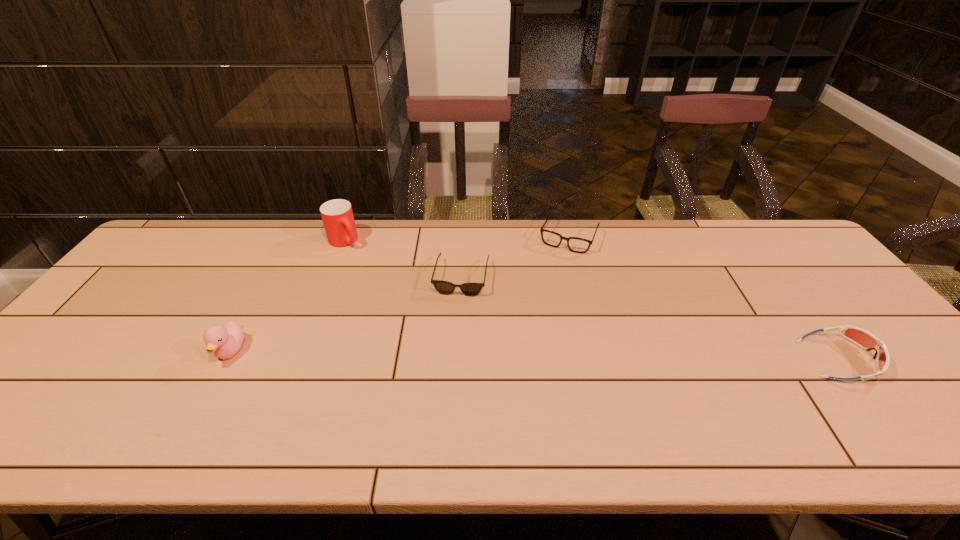
Where is `sunglasses that is at the far edge`? This screenshot has height=540, width=960. sunglasses that is at the far edge is located at coordinates (444, 287).

Image resolution: width=960 pixels, height=540 pixels. Find the location of `cup at the far edge`. cup at the far edge is located at coordinates (337, 215).

Locate an element on the screen. Image resolution: width=960 pixels, height=540 pixels. object that is positioned at the near edge is located at coordinates (863, 338).

Find the location of a particular element. This screenshot has height=540, width=960. object that is positioned at the right edge is located at coordinates (863, 338).

You are a GUI agent. You are given a task and a screenshot of the screen. Output one action in this format:
    pyautogui.click(x=<x>, y=<y>)
    Task: Click on the object present at the near right corner
    This screenshot has height=540, width=960.
    Given the screenshot: What is the action you would take?
    [863, 338]

The width and height of the screenshot is (960, 540). In the image, there is a desktop. Find the location of `free space at the far edge`. free space at the far edge is located at coordinates (326, 249).

Identify the location of vacant space at the near edge of the desktop. (100, 405).

The image size is (960, 540). What are the coordinates of `vacant region at the left edge of the desktop` in the screenshot? It's located at (184, 272).

At what (x,y) coordinates should I click in order to perform the action: click on free region at the right edge of the desktop. Please return your answer as a coordinate pair (x, y). Looking at the image, I should click on (809, 279).

Find the location of `empty space between the second object from left to right and the leftmost object`. empty space between the second object from left to right and the leftmost object is located at coordinates (287, 296).